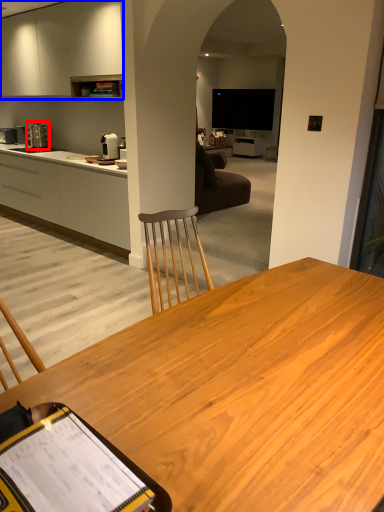
Question: Which of the following is the farthest to the observer, coffee machine (highlighted by a red box) or cabinetry (highlighted by a blue box)?

Choices:
 (A) coffee machine
 (B) cabinetry

Answer: (A)